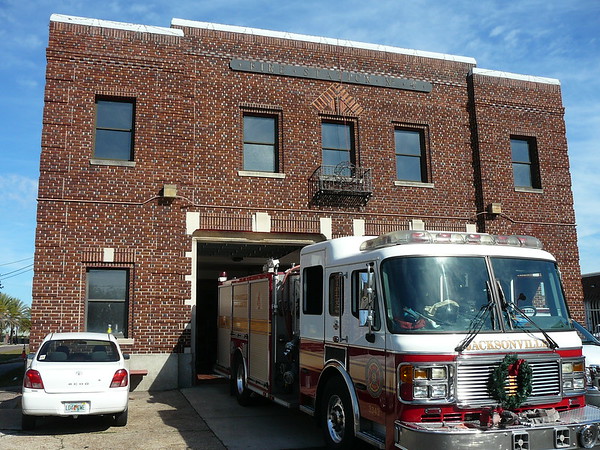
The image size is (600, 450). In order to click on window in this screenshot , I will do `click(521, 172)`.